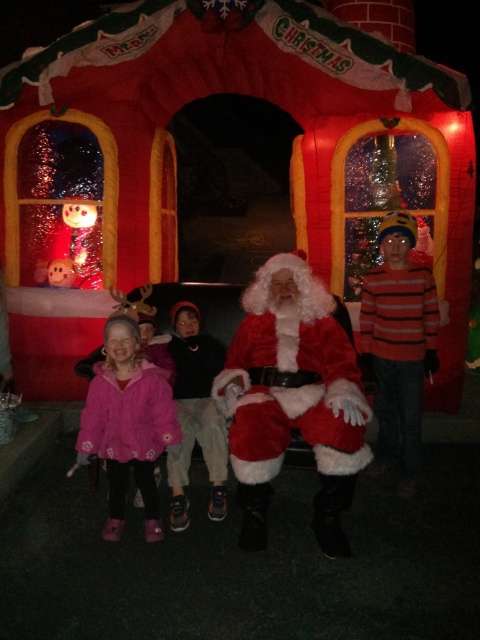
Between point (363, 339) and point (307, 422), which one is positioned behind?

Positioned behind is point (363, 339).

Describe the element at coordinates (294, 396) in the screenshot. The height and width of the screenshot is (640, 480). I see `fuzzy white santa at center` at that location.

Locate an element on the screen. This screenshot has width=480, height=640. fuzzy white santa at center is located at coordinates (294, 396).

Between point (287, 266) and point (142, 401), which one is positioned behind?

Point (287, 266)

Between fuzzy white santa at center and pink fleece jacket at lower left, which one has more height?

With more height is fuzzy white santa at center.

Who is more forward, (311, 289) or (144, 374)?

Point (144, 374) is more forward.

I want to click on fuzzy white santa at center, so click(x=294, y=396).

Does fuzzy red santa at center appear on the right side of pink fleece jacket at lower left?

Yes, fuzzy red santa at center is to the right of pink fleece jacket at lower left.

Does fuzzy red santa at center have a lesser width compared to pink fleece jacket at lower left?

No, fuzzy red santa at center is not thinner than pink fleece jacket at lower left.

Where is `fuzzy red santa at center`? fuzzy red santa at center is located at coordinates (291, 397).

Where is `fuzzy red santa at center`? The image size is (480, 640). fuzzy red santa at center is located at coordinates (291, 397).